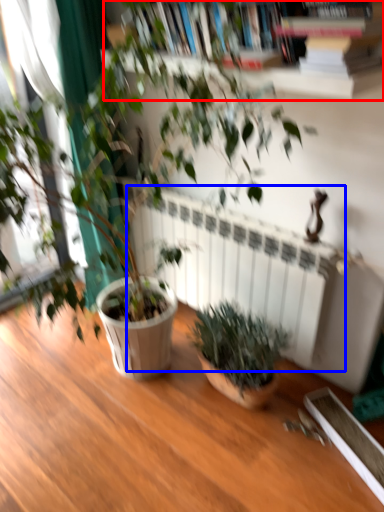
Question: Which point is closer to the camera, bookcase (highlighted by a red box) or radiator (highlighted by a blue box)?

Choices:
 (A) bookcase
 (B) radiator

Answer: (A)